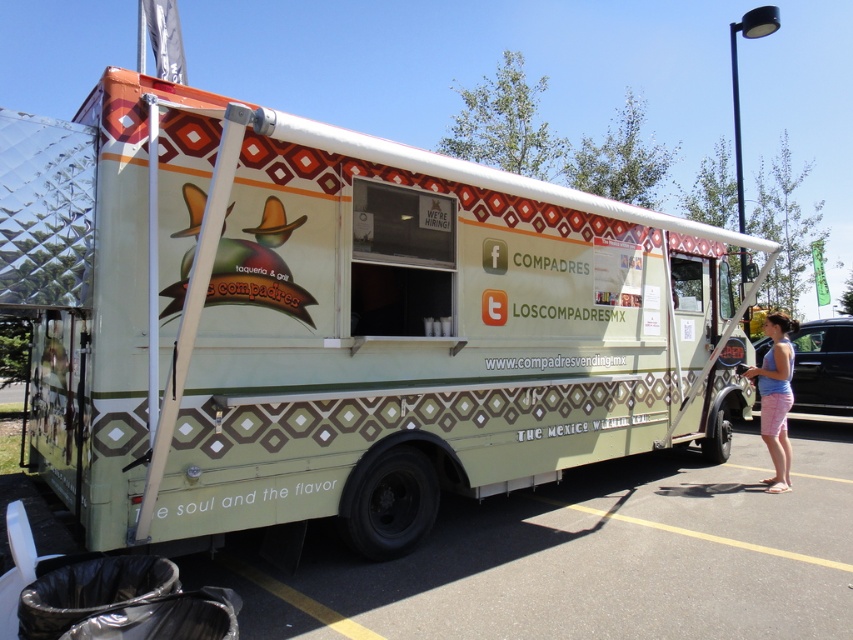
You are a customer standing at the food truck and see the green asphalt at lower center and the pink cotton shorts at lower right. Which object is closer to you?

The pink cotton shorts at lower right are closer to you because the green asphalt at lower center is positioned under them, indicating the shorts are above and nearer to your viewpoint.

You are standing at the point marked as point (589, 556) on the image. What is the color of the surface you are currently standing on?

The surface at point (589, 556) is green asphalt, so the color is green.

You are standing at point 0.505, 0.394. You want to find the matte green food truck at center. Where should you look?

You are already at the location of the matte green food truck at center, which is at point (335, 323).